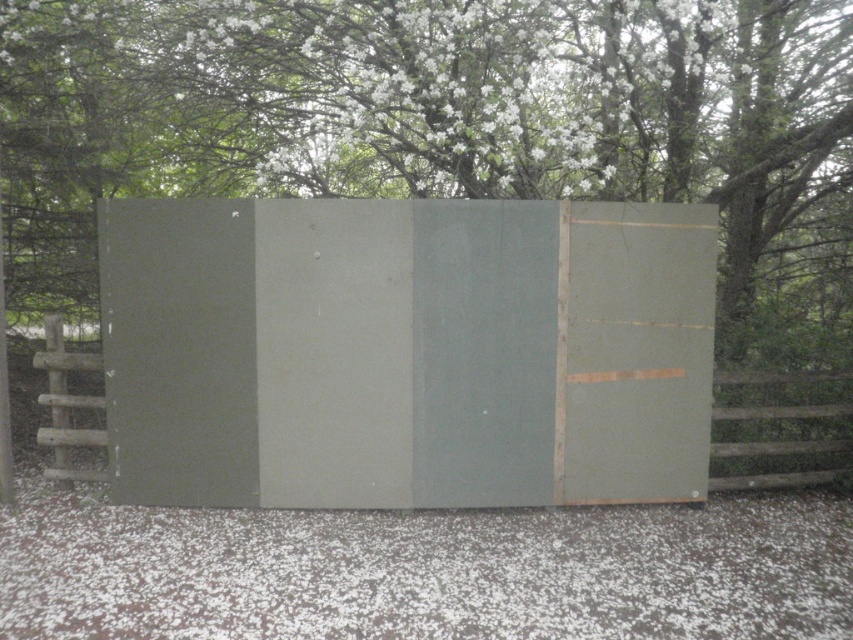
Who is higher up, matte green panel at center or white fluffy snow at lower center?

Positioned higher is matte green panel at center.

Can you confirm if matte green panel at center is positioned to the right of white fluffy snow at lower center?

In fact, matte green panel at center is to the left of white fluffy snow at lower center.

Does point (503, 316) come in front of point (799, 557)?

No, (503, 316) is further to viewer.

Identify the location of matte green panel at center. The width and height of the screenshot is (853, 640). (405, 352).

Does white fluffy snow at lower center have a greater width compared to brown wooden fence at right?

Yes, white fluffy snow at lower center is wider than brown wooden fence at right.

Can you confirm if white fluffy snow at lower center is thinner than brown wooden fence at right?

No.

The height and width of the screenshot is (640, 853). Find the location of `white fluffy snow at lower center`. white fluffy snow at lower center is located at coordinates (427, 572).

Locate an element on the screen. Image resolution: width=853 pixels, height=640 pixels. white fluffy snow at lower center is located at coordinates (427, 572).

Looking at this image, which is above, green matte wall at upper center or matte green panel at center?

green matte wall at upper center is higher up.

Is point (322, 141) positioned in front of point (451, 278)?

No.

You are a GUI agent. You are given a task and a screenshot of the screen. Output one action in this format:
    pyautogui.click(x=<x>, y=<y>)
    Task: Click on the green matte wall at upper center
    
    Given the screenshot: What is the action you would take?
    pyautogui.click(x=440, y=120)